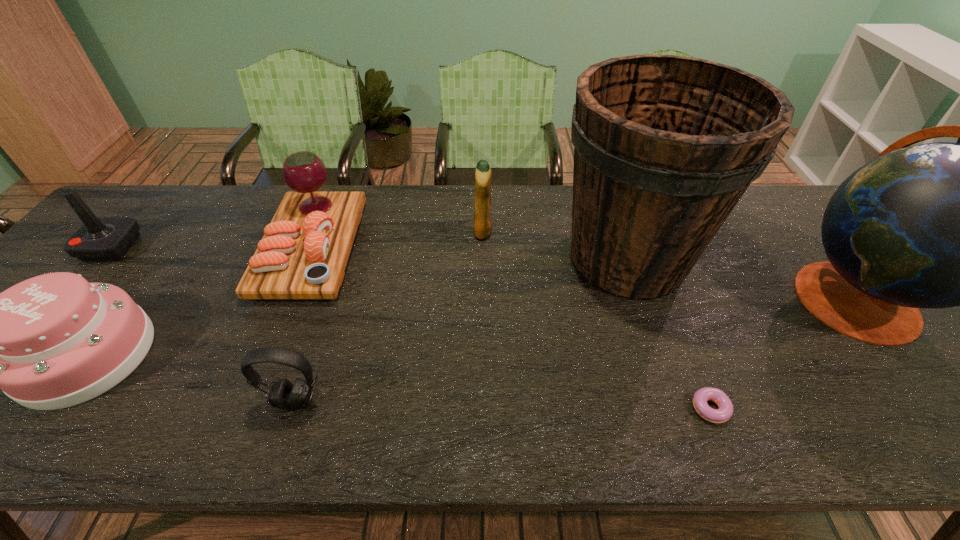
Locate an element on the screen. vacant area located on the left of the platter is located at coordinates (151, 248).

Image resolution: width=960 pixels, height=540 pixels. What are the coordinates of `vacant space located 0.250m on the right of the joystick` in the screenshot? It's located at tap(225, 248).

The width and height of the screenshot is (960, 540). Find the location of `blank space located on the back of the shortest object`. blank space located on the back of the shortest object is located at coordinates (696, 372).

Where is `bucket at the far edge`? The height and width of the screenshot is (540, 960). bucket at the far edge is located at coordinates (665, 146).

This screenshot has height=540, width=960. I want to click on detergent that is at the far edge, so click(482, 203).

Where is `platter positioned at the far edge`? platter positioned at the far edge is located at coordinates (303, 254).

You are a GUI agent. You are given a task and a screenshot of the screen. Output one action in this format:
    pyautogui.click(x=<x>, y=<y>)
    Task: Click on the joystick located in the far edge section of the desktop
    This screenshot has height=540, width=960.
    Given the screenshot: What is the action you would take?
    pyautogui.click(x=99, y=238)

Identify the location of headset at the near edge. This screenshot has height=540, width=960. (284, 395).

Image resolution: width=960 pixels, height=540 pixels. What are the coordinates of `doughnut at the near edge` in the screenshot? It's located at (724, 412).

The image size is (960, 540). I want to click on object positioned at the left edge, so click(99, 238).